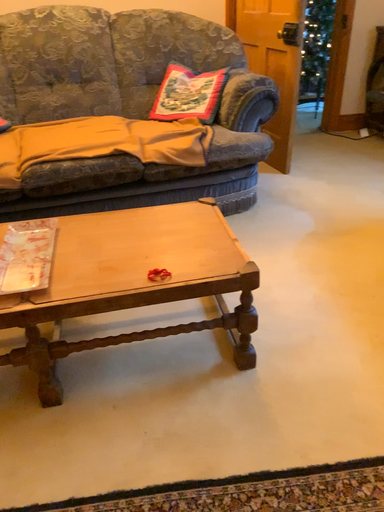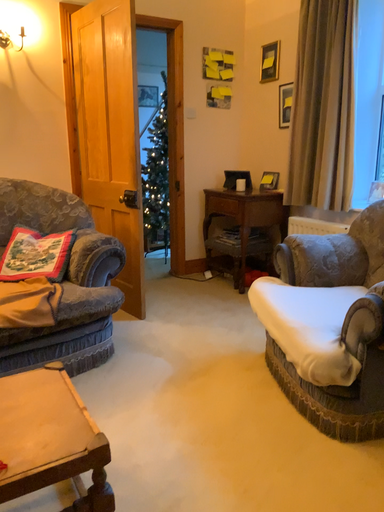
Question: How did the camera likely rotate when shooting the video?

Choices:
 (A) rotated upward
 (B) rotated downward

Answer: (A)